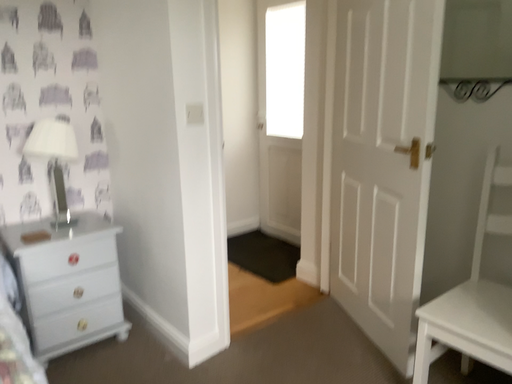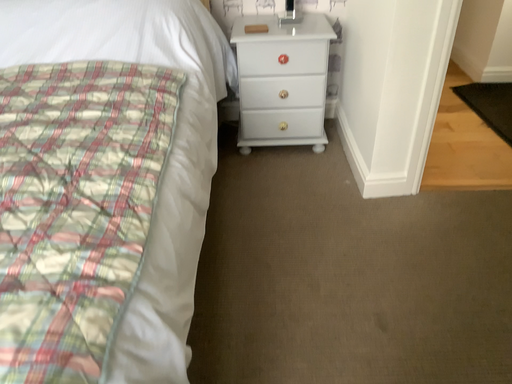
Question: Which way did the camera rotate in the video?

Choices:
 (A) rotated left
 (B) rotated right

Answer: (A)